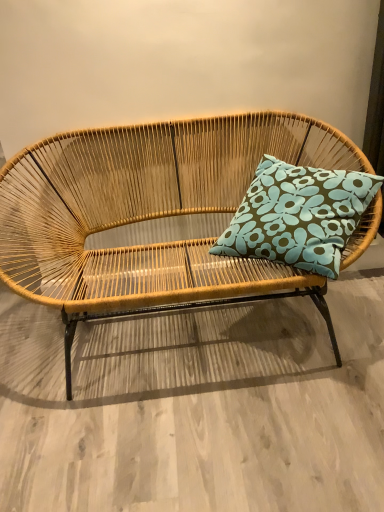
Question: Is the depth of teal floral cushion at center greater than that of natural woven studio couch at center?

Choices:
 (A) no
 (B) yes

Answer: (B)

Question: Is teal floral cushion at center wider than natural woven studio couch at center?

Choices:
 (A) no
 (B) yes

Answer: (A)

Question: Is teal floral cushion at center surrounding natural woven studio couch at center?

Choices:
 (A) yes
 (B) no

Answer: (B)

Question: Considering the relative sizes of teal floral cushion at center and natural woven studio couch at center in the image provided, is teal floral cushion at center shorter than natural woven studio couch at center?

Choices:
 (A) yes
 (B) no

Answer: (A)

Question: Is teal floral cushion at center bigger than natural woven studio couch at center?

Choices:
 (A) yes
 (B) no

Answer: (B)

Question: From a real-world perspective, is teal floral cushion at center positioned under natural woven studio couch at center based on gravity?

Choices:
 (A) yes
 (B) no

Answer: (B)

Question: Is natural woven studio couch at center aimed at teal floral cushion at center?

Choices:
 (A) no
 (B) yes

Answer: (B)

Question: Considering the relative sizes of natural woven studio couch at center and teal floral cushion at center in the image provided, is natural woven studio couch at center wider than teal floral cushion at center?

Choices:
 (A) no
 (B) yes

Answer: (B)

Question: Is the surface of natural woven studio couch at center in direct contact with teal floral cushion at center?

Choices:
 (A) no
 (B) yes

Answer: (A)

Question: Considering the relative sizes of natural woven studio couch at center and teal floral cushion at center in the image provided, is natural woven studio couch at center bigger than teal floral cushion at center?

Choices:
 (A) yes
 (B) no

Answer: (A)

Question: Can you confirm if natural woven studio couch at center is taller than teal floral cushion at center?

Choices:
 (A) no
 (B) yes

Answer: (B)

Question: Is natural woven studio couch at center at the right side of teal floral cushion at center?

Choices:
 (A) no
 (B) yes

Answer: (A)

Question: Is teal floral cushion at center situated inside natural woven studio couch at center or outside?

Choices:
 (A) outside
 (B) inside

Answer: (B)